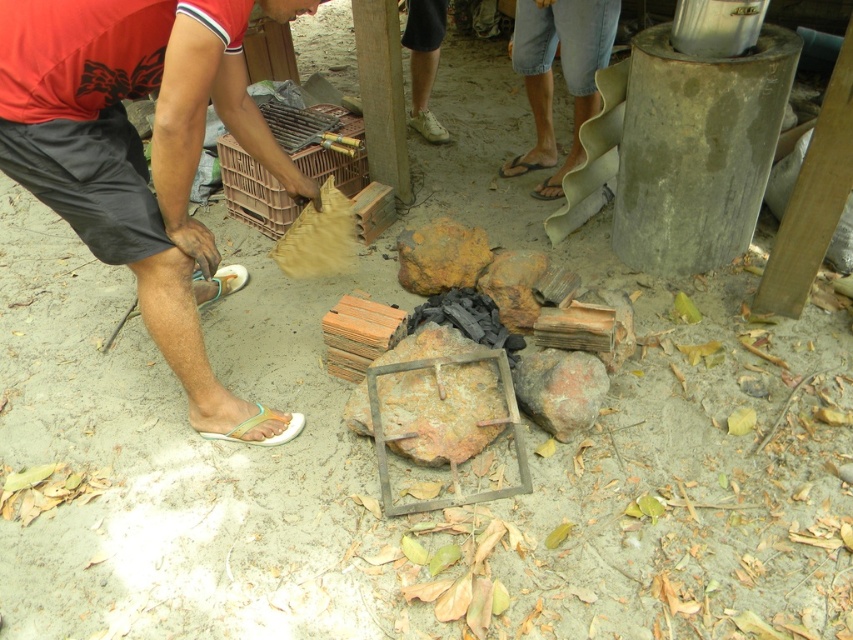
Question: Which point is closer to the camera?

Choices:
 (A) pyautogui.click(x=428, y=244)
 (B) pyautogui.click(x=143, y=83)
 (C) pyautogui.click(x=531, y=372)
 (D) pyautogui.click(x=517, y=52)

Answer: (B)

Question: Does matte black sandal at lower left lie behind blue denim shorts at upper right?

Choices:
 (A) no
 (B) yes

Answer: (A)

Question: Can you confirm if matte black sandal at lower left is positioned to the right of rusty metal rock at center?

Choices:
 (A) yes
 (B) no

Answer: (B)

Question: Can you confirm if blue denim shorts at upper right is positioned below rusty metal rock at center?

Choices:
 (A) no
 (B) yes

Answer: (A)

Question: Which of the following is the farthest from the observer?

Choices:
 (A) (578, 417)
 (B) (164, 236)
 (C) (558, 13)
 (D) (436, 236)

Answer: (C)

Question: Which object appears farthest from the camera in this image?

Choices:
 (A) blue denim shorts at upper right
 (B) matte black sandal at lower left

Answer: (A)